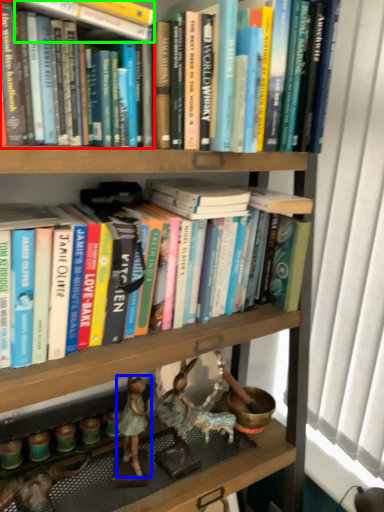
Question: Which object is positioned farthest from book (highlighted by a red box)? Select from person (highlighted by a blue box) and book (highlighted by a green box).

Choices:
 (A) person
 (B) book

Answer: (A)